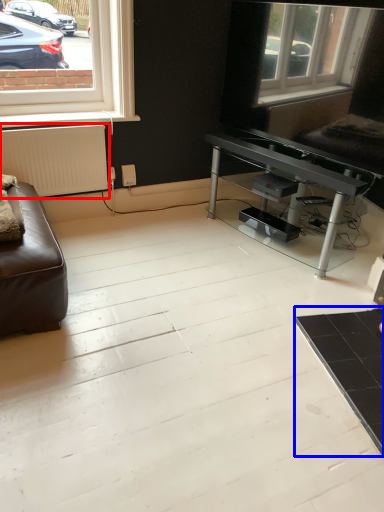
Question: Which object is closer to the camera taking this photo, radiator (highlighted by a red box) or table (highlighted by a blue box)?

Choices:
 (A) radiator
 (B) table

Answer: (B)